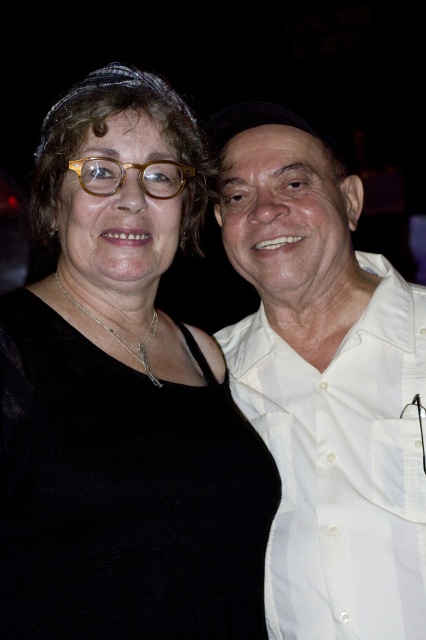
Question: Which point appears closest to the camera in this image?

Choices:
 (A) (250, 490)
 (B) (304, 625)
 (C) (164, 198)

Answer: (A)

Question: Which point is closer to the camera?

Choices:
 (A) 414,464
 (B) 149,145

Answer: (B)

Question: Does black velvet top at center have a greater width compared to white cotton shirt at right?

Choices:
 (A) yes
 (B) no

Answer: (A)

Question: Among these points, which one is nearest to the camera?

Choices:
 (A) (77, 173)
 (B) (330, 605)
 (C) (77, 236)

Answer: (A)

Question: Is white cotton shirt at right to the right of tortoiseshell frame glasses at upper center from the viewer's perspective?

Choices:
 (A) no
 (B) yes

Answer: (B)

Question: Can you confirm if black velvet top at center is bigger than white cotton shirt at right?

Choices:
 (A) no
 (B) yes

Answer: (A)